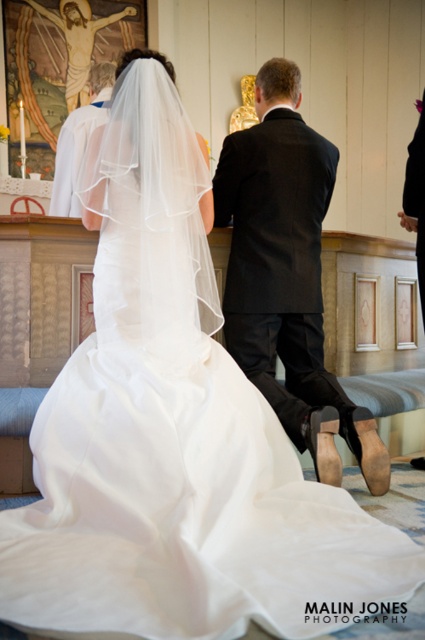
Question: Which object appears farthest from the camera in this image?

Choices:
 (A) matte white robe at upper center
 (B) black satin suit at center

Answer: (A)

Question: Is black satin suit at center wider than matte white robe at upper center?

Choices:
 (A) yes
 (B) no

Answer: (A)

Question: Is black satin suit at center positioned behind matte white robe at upper center?

Choices:
 (A) yes
 (B) no

Answer: (B)

Question: Does black satin suit at center appear under matte white robe at upper center?

Choices:
 (A) yes
 (B) no

Answer: (A)

Question: Which of the following is the closest to the observer?

Choices:
 (A) (110, 86)
 (B) (278, 337)

Answer: (B)